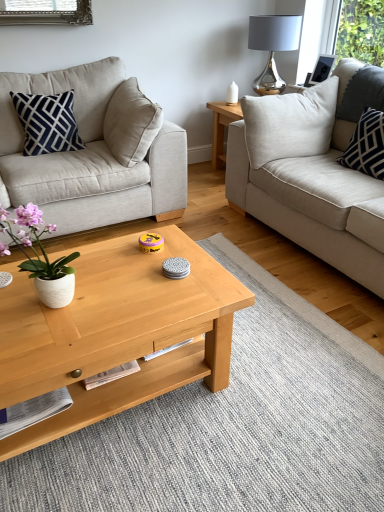
Locate an element on the screen. vacant space to the right of white ceramic pot at left is located at coordinates (106, 308).